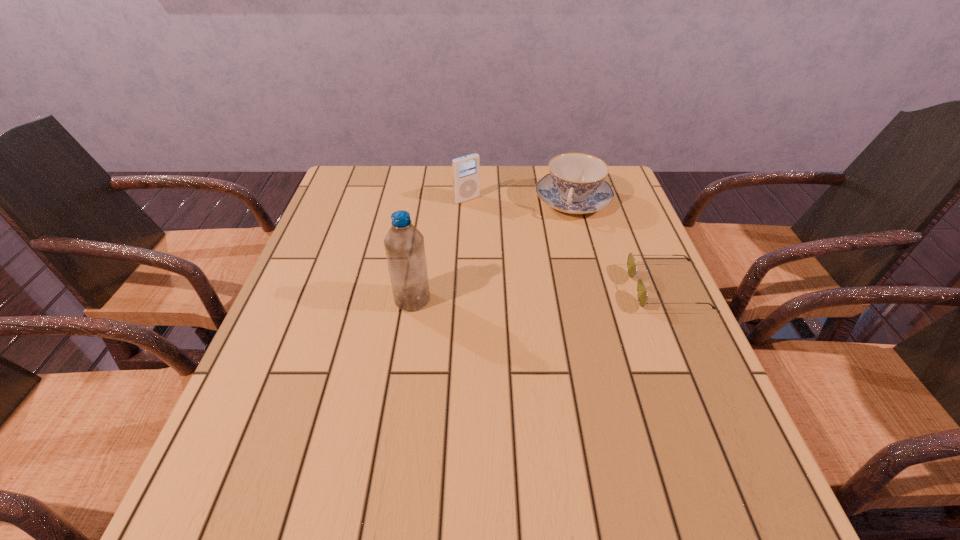
Where is `vacant region located 0.230m with the handle on the side of the chinaware`? vacant region located 0.230m with the handle on the side of the chinaware is located at coordinates (556, 275).

Where is `free space located 0.190m with the handle on the side of the chinaware`? This screenshot has width=960, height=540. free space located 0.190m with the handle on the side of the chinaware is located at coordinates (559, 265).

At what (x,y) coordinates should I click in order to perform the action: click on free space located 0.200m with the handle on the side of the chinaware. Please return your answer as a coordinate pair (x, y). This screenshot has width=960, height=540. Looking at the image, I should click on (558, 267).

Image resolution: width=960 pixels, height=540 pixels. I want to click on vacant position located 0.200m on the front-facing side of the third object from right to left, so click(511, 239).

Identify the location of vacant point located on the front-facing side of the third object from right to left. (492, 222).

The image size is (960, 540). I want to click on free space located on the front-facing side of the third object from right to left, so click(x=498, y=228).

Locate an element on the screen. chinaware present at the far edge is located at coordinates (575, 185).

What are the coordinates of `iPod present at the far edge` in the screenshot? It's located at (466, 170).

The height and width of the screenshot is (540, 960). Find the location of `sunglasses present at the right edge`. sunglasses present at the right edge is located at coordinates (642, 295).

Find the location of `chinaware present at the right edge`. chinaware present at the right edge is located at coordinates (575, 185).